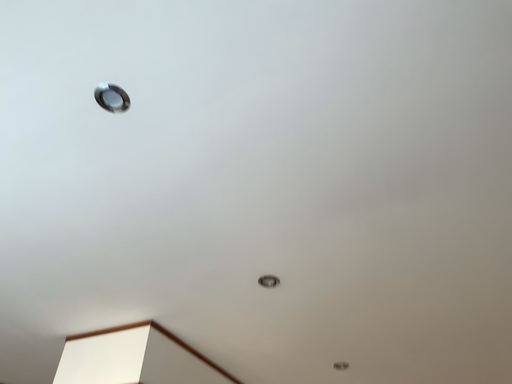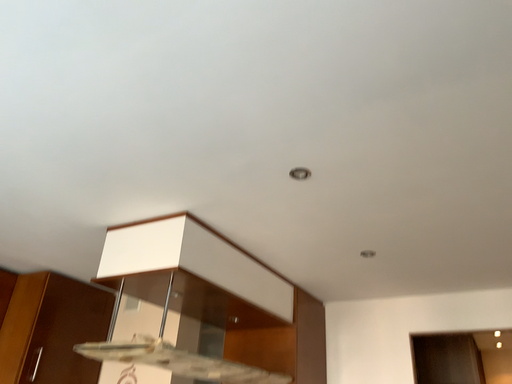
Question: Which way did the camera rotate in the video?

Choices:
 (A) rotated upward
 (B) rotated downward

Answer: (B)